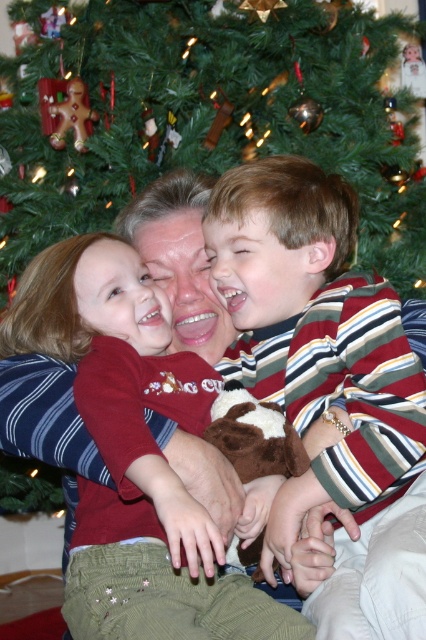
Looking at the family photo with the Christmas tree, you notice the striped cotton shirt at center and the matte gingerbread man at upper left. Which of these two items is positioned more to the left side of the image?

The matte gingerbread man at upper left is positioned more to the left side of the image than the striped cotton shirt at center.

You are a photographer trying to capture a clear shot of the striped cotton shirt at center and the matte gingerbread man at upper left. Based on their positions, which object is closer to the camera?

The striped cotton shirt at center is closer to the camera because it is in front of the matte gingerbread man at upper left.